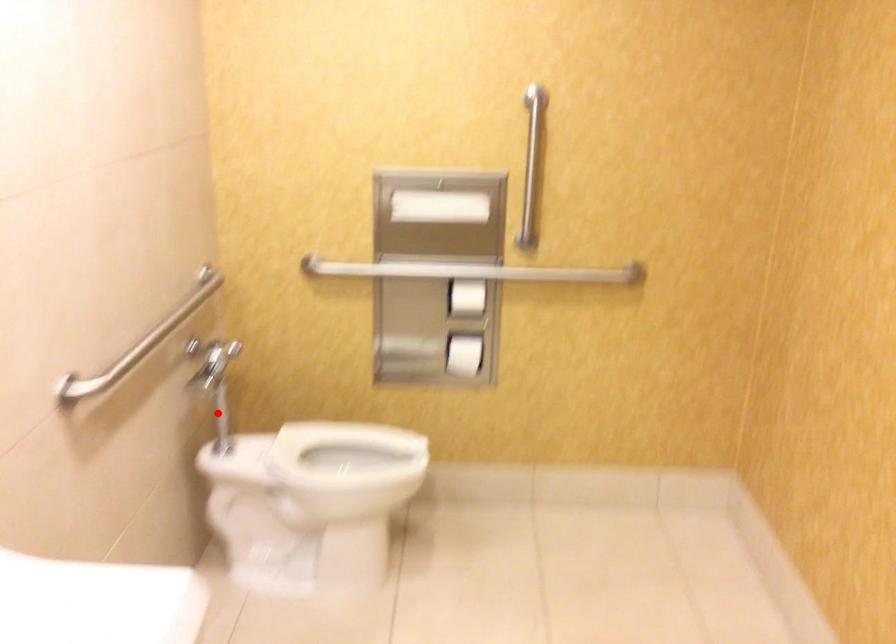
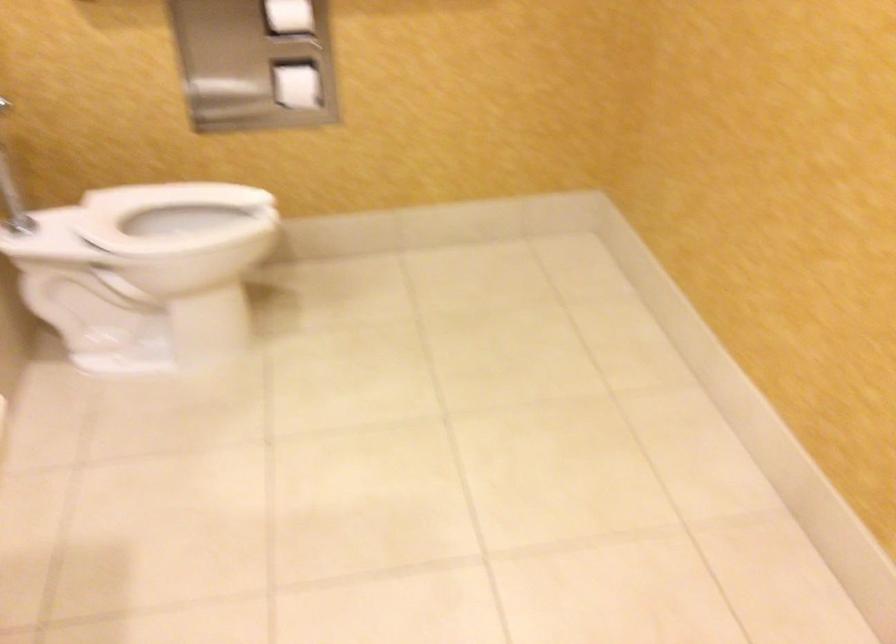
Question: I am providing you with two images of the same scene from different viewpoints. Given a red point in image1, look at the same physical point in image2. Is it:

Choices:
 (A) Closer to the viewpoint
 (B) Farther from the viewpoint

Answer: (A)